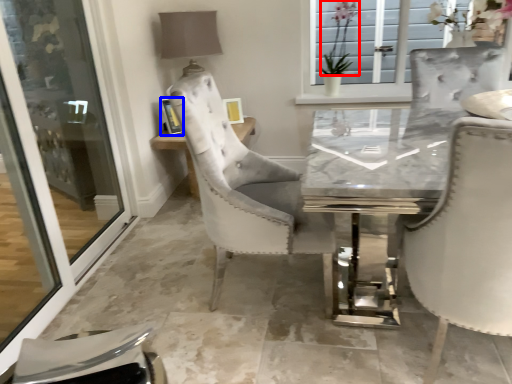
Question: Which object is further to the camera taking this photo, flower (highlighted by a red box) or picture frame (highlighted by a blue box)?

Choices:
 (A) flower
 (B) picture frame

Answer: (A)